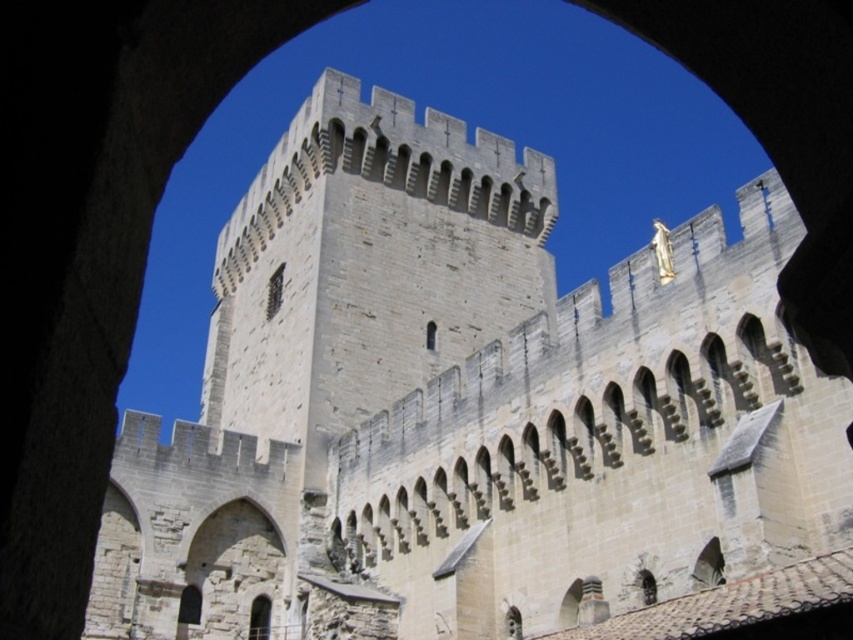
Question: Which point is farther to the camera?

Choices:
 (A) (431, 324)
 (B) (265, 316)
 (C) (198, 598)

Answer: (B)

Question: Does matte stone window at center appear on the left side of smooth stone window at center?

Choices:
 (A) yes
 (B) no

Answer: (A)

Question: Is stone window at lower left smaller than matte stone window at lower left?

Choices:
 (A) no
 (B) yes

Answer: (A)

Question: Among these points, which one is farthest from the camera?

Choices:
 (A) (280, 291)
 (B) (428, 348)
 (C) (199, 609)

Answer: (A)

Question: Estimate the real-world distances between objects in this image. Which object is farther from the matte stone window at center?

Choices:
 (A) matte stone window at lower left
 (B) stone window at lower left
 (C) smooth stone window at center

Answer: (A)

Question: Can you confirm if stone window at lower left is bigger than matte stone window at center?

Choices:
 (A) no
 (B) yes

Answer: (A)